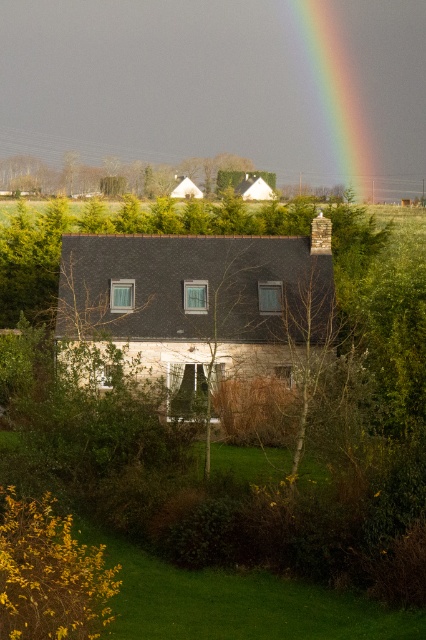
In the scene shown: You are standing in front of the house and see two points marked in the image. The first point is at coordinates point (313, 340) and the second is at point (31, 163). Which point is closer to you?

Point (313, 340) is in front of point (31, 163), so the first point is closer to you.

Based on the photo, you are a landscape photographer planning to capture the entire scene of the quaint house with both the bare branches at center and the rainbow at upper center in your shot. Considering their sizes, which object will require you to adjust your camera angle more to ensure it is fully visible?

The rainbow at upper center requires more adjustment since the bare branches at center occupies less space than rainbow at upper center, making it smaller and easier to frame within the shot.

You are standing in front of the house and notice two elements in the scene. Identify which one is positioned to the left of the other between the bare branches at center and the rainbow at upper center.

The bare branches at center are positioned to the left of the rainbow at upper center.